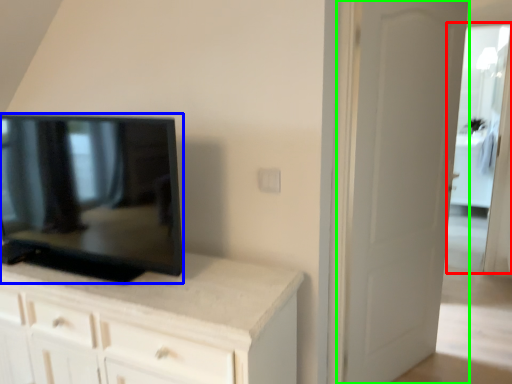
Question: Considering the real-world distances, which object is closest to glass door (highlighted by a red box)? television (highlighted by a blue box) or door (highlighted by a green box).

Choices:
 (A) television
 (B) door

Answer: (B)